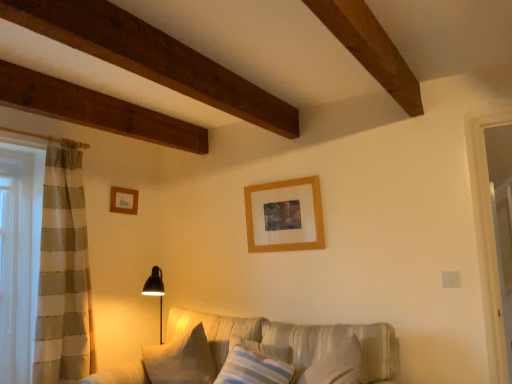
Question: Which direction should I rotate to face white soft pillow at lower center, which is the 2th pillow from right to left, — up or down?

Choices:
 (A) up
 (B) down

Answer: (B)

Question: Should I look upward or downward to see wooden picture frame at upper left, the second picture frame when ordered from right to left?

Choices:
 (A) up
 (B) down

Answer: (B)

Question: Is white soft pillow at lower center, which is the 2th pillow from right to left, facing towards textured beige couch at center?

Choices:
 (A) yes
 (B) no

Answer: (A)

Question: Is white soft pillow at lower center, which is the 2th pillow from right to left, turned away from textured beige couch at center?

Choices:
 (A) no
 (B) yes

Answer: (B)

Question: Is white soft pillow at lower center, placed as the first pillow when sorted from left to right, taller than textured beige couch at center?

Choices:
 (A) no
 (B) yes

Answer: (A)

Question: Does white soft pillow at lower center, placed as the first pillow when sorted from left to right, have a greater width compared to textured beige couch at center?

Choices:
 (A) no
 (B) yes

Answer: (A)

Question: Considering the relative sizes of white soft pillow at lower center, placed as the first pillow when sorted from left to right, and textured beige couch at center in the image provided, is white soft pillow at lower center, placed as the first pillow when sorted from left to right, bigger than textured beige couch at center?

Choices:
 (A) yes
 (B) no

Answer: (B)

Question: Is white soft pillow at lower center, placed as the first pillow when sorted from left to right, directly adjacent to textured beige couch at center?

Choices:
 (A) no
 (B) yes

Answer: (A)

Question: Considering the relative positions of wooden picture frame at upper center, which is counted as the first picture frame, starting from the front, and white soft pillow at lower center, placed as the first pillow when sorted from left to right, in the image provided, is wooden picture frame at upper center, which is counted as the first picture frame, starting from the front, to the right of white soft pillow at lower center, placed as the first pillow when sorted from left to right, from the viewer's perspective?

Choices:
 (A) yes
 (B) no

Answer: (A)

Question: Can you confirm if wooden picture frame at upper center, which is counted as the first picture frame, starting from the front, is bigger than white soft pillow at lower center, which is the 2th pillow from right to left?

Choices:
 (A) no
 (B) yes

Answer: (A)

Question: Is wooden picture frame at upper center, which is the 2th picture frame in back-to-front order, located outside white soft pillow at lower center, placed as the first pillow when sorted from left to right?

Choices:
 (A) yes
 (B) no

Answer: (A)

Question: Are wooden picture frame at upper center, which is counted as the first picture frame, starting from the front, and white soft pillow at lower center, placed as the first pillow when sorted from left to right, located far from each other?

Choices:
 (A) yes
 (B) no

Answer: (B)

Question: Is wooden picture frame at upper center, which is counted as the first picture frame, starting from the front, shorter than white soft pillow at lower center, which is the 2th pillow from right to left?

Choices:
 (A) no
 (B) yes

Answer: (B)

Question: From a real-world perspective, does wooden picture frame at upper center, which is the 2th picture frame in back-to-front order, sit lower than white soft pillow at lower center, placed as the first pillow when sorted from left to right?

Choices:
 (A) yes
 (B) no

Answer: (B)

Question: Is textured beige couch at center further to the viewer compared to white soft pillow at lower center, which is the 2th pillow from right to left?

Choices:
 (A) no
 (B) yes

Answer: (A)